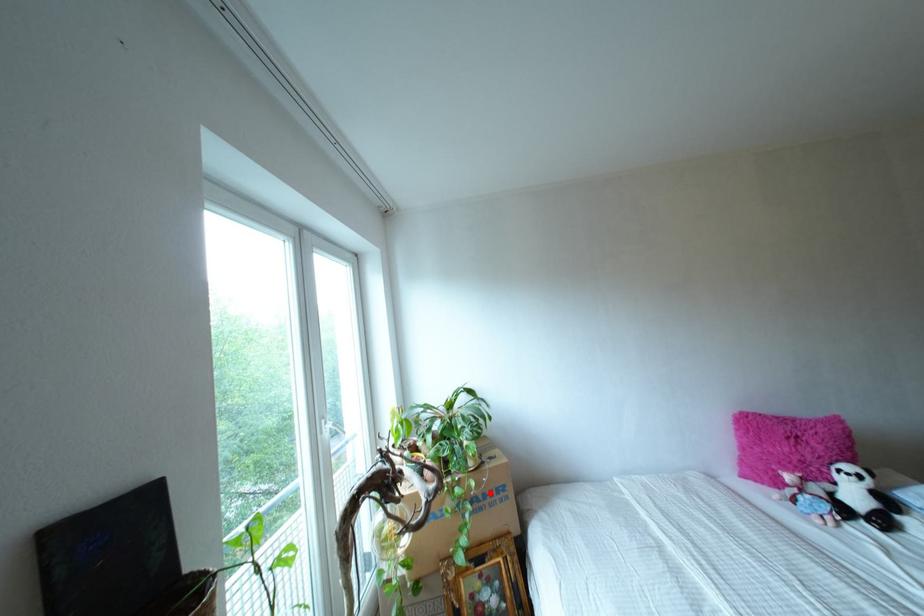
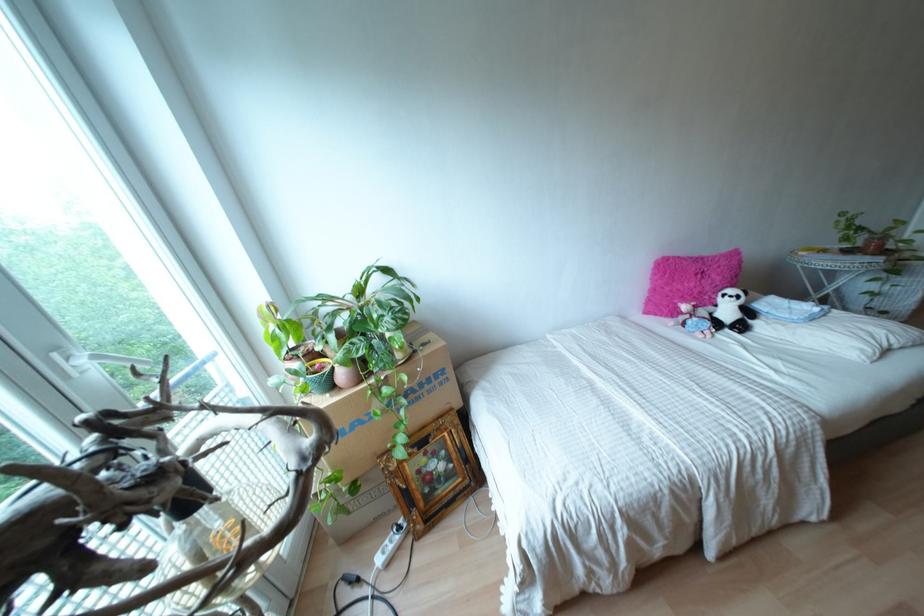
Question: I am providing you with two images of the same scene from different viewpoints. Image1 has a red point marked. In image2, the corresponding 3D location appears at what relative position? Reply with the corresponding letter.

Choices:
 (A) Closer
 (B) Farther

Answer: (A)